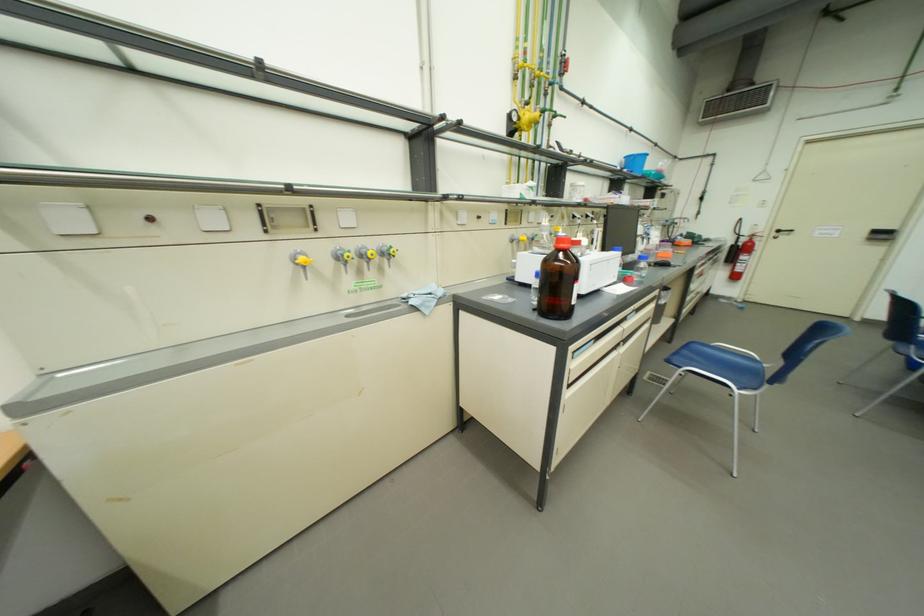
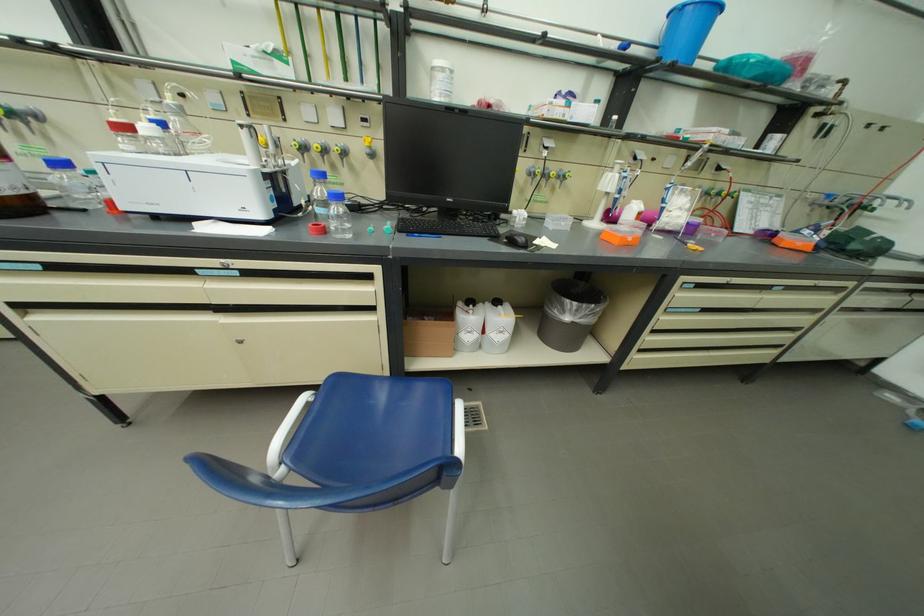
In the second image, find the point that corresponds to point (672, 304) in the first image.

(577, 320)